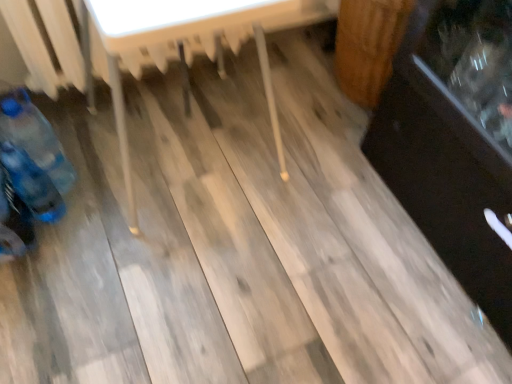
You are a GUI agent. You are given a task and a screenshot of the screen. Output one action in this format:
    pyautogui.click(x=<x>, y=<y>)
    Task: Click on the unoccupied space behind blue plastic bottle at left, arranged as the 1th bottle when viewed from the top
    This screenshot has width=512, height=384.
    Given the screenshot: What is the action you would take?
    pyautogui.click(x=84, y=142)